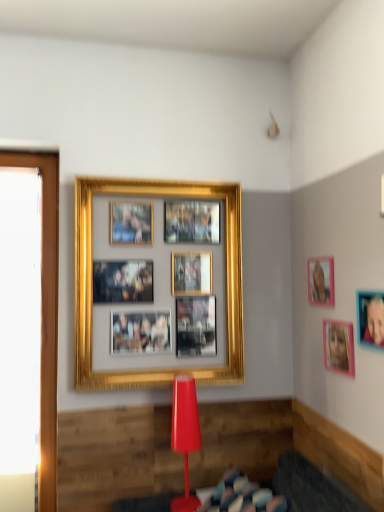
Question: In terms of size, does transparent glass window at left appear bigger or smaller than pink matte picture frame at upper right, which appears as the 2th picture frame when viewed from the front?

Choices:
 (A) big
 (B) small

Answer: (A)

Question: From the image's perspective, is transparent glass window at left located above or below pink matte picture frame at upper right, which is the 3th picture frame from left to right?

Choices:
 (A) below
 (B) above

Answer: (A)

Question: Which object is the closest to the matte red table lamp at center?

Choices:
 (A) pink matte picture frame at upper right, the 2th picture frame when ordered from left to right
 (B) transparent glass window at left
 (C) pink matte picture frame at upper right, the fourth picture frame in the back-to-front sequence
 (D) gold metallic picture frame at upper center, which is the 4th picture frame from right to left
 (E) pink matte picture frame at upper right, which is the 3th picture frame from left to right

Answer: (D)

Question: Estimate the real-world distances between objects in this image. Which object is farther from the gold metallic picture frame at upper center, which is the 4th picture frame from right to left?

Choices:
 (A) transparent glass window at left
 (B) rubberized plastic stool at lower center
 (C) pink matte picture frame at upper right, the 1th picture frame viewed from the right
 (D) pink matte picture frame at upper right, which is the 3th picture frame from left to right
 (E) pink matte picture frame at upper right, acting as the 3th picture frame starting from the front

Answer: (C)